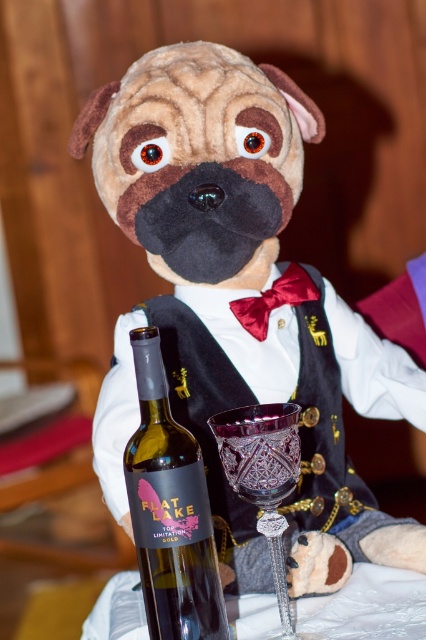
Does brown plush dog at center have a greater height compared to amber crystal wine glass at center?

Yes, brown plush dog at center is taller than amber crystal wine glass at center.

Does brown plush dog at center have a larger size compared to amber crystal wine glass at center?

Indeed, brown plush dog at center has a larger size compared to amber crystal wine glass at center.

Locate an element on the screen. This screenshot has height=640, width=426. brown plush dog at center is located at coordinates (241, 305).

Can you confirm if translucent glass bottle at center is thinner than amber crystal wine glass at center?

Yes, translucent glass bottle at center is thinner than amber crystal wine glass at center.

Which is behind, point (204, 524) or point (273, 548)?

Positioned behind is point (273, 548).

Between point (160, 394) and point (250, 417), which one is positioned in front?

Point (160, 394)

Image resolution: width=426 pixels, height=640 pixels. Identify the location of translucent glass bottle at center. (169, 512).

Measure the distance between brown plush dog at center and translucent glass bottle at center.

A distance of 9.66 inches exists between brown plush dog at center and translucent glass bottle at center.

Which is in front, point (215, 170) or point (193, 609)?

Positioned in front is point (193, 609).

Locate an element on the screen. brown plush dog at center is located at coordinates (241, 305).